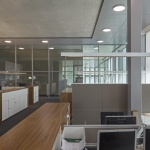
I want to click on white overhead lights, so click(117, 53).